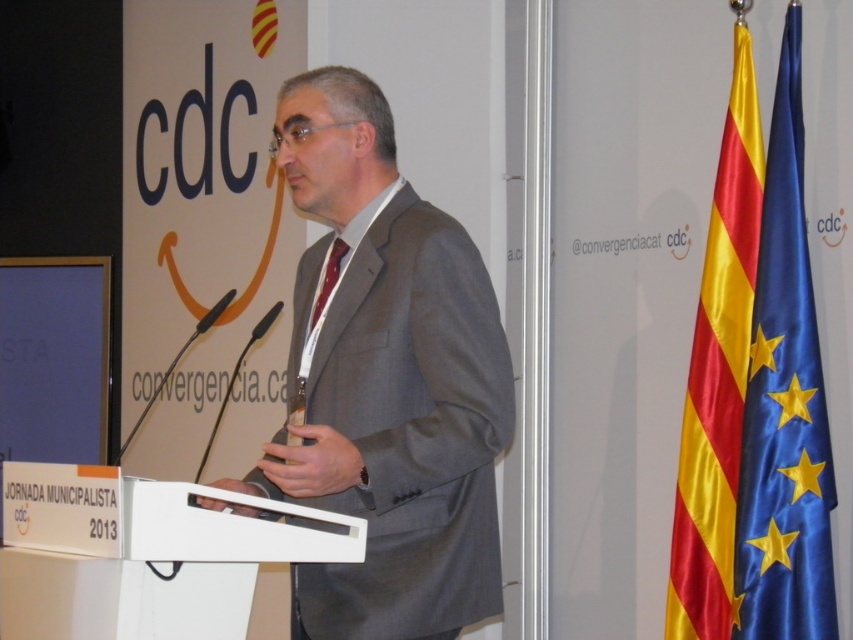
Does gray suit at center have a greater width compared to blue fabric flag at right?

Yes.

Between gray suit at center and blue fabric flag at right, which one has less height?

gray suit at center is shorter.

At what (x,y) coordinates should I click in order to perform the action: click on gray suit at center. Please return your answer as a coordinate pair (x, y). This screenshot has height=640, width=853. Looking at the image, I should click on (386, 381).

From the picture: Measure the distance between blue fabric flag at right and matte red tie at center.

blue fabric flag at right and matte red tie at center are 35.16 inches apart from each other.

Can you confirm if blue fabric flag at right is positioned below matte red tie at center?

Indeed, blue fabric flag at right is positioned under matte red tie at center.

This screenshot has height=640, width=853. I want to click on blue fabric flag at right, so click(x=784, y=403).

Who is shorter, gray suit at center or yellow/red striped fabric flag at right?

gray suit at center

Who is more forward, (462, 259) or (729, 620)?

Positioned in front is point (462, 259).

Where is `gray suit at center`? Image resolution: width=853 pixels, height=640 pixels. gray suit at center is located at coordinates (386, 381).